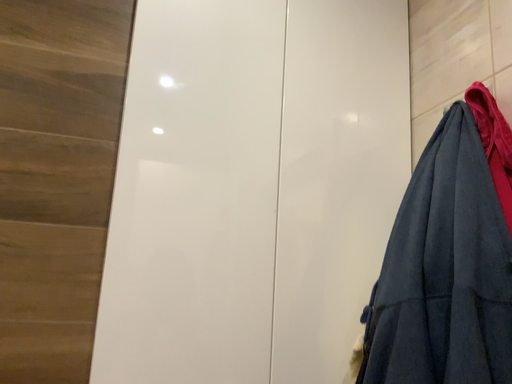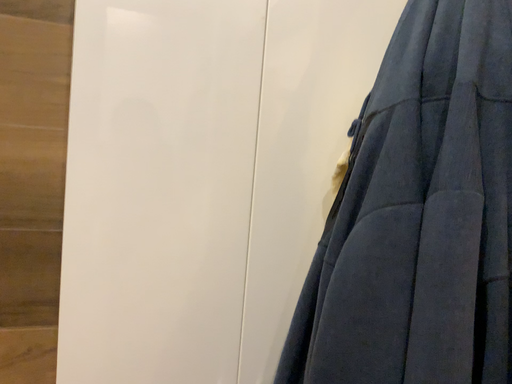
Question: Which way did the camera rotate in the video?

Choices:
 (A) rotated downward
 (B) rotated upward

Answer: (A)